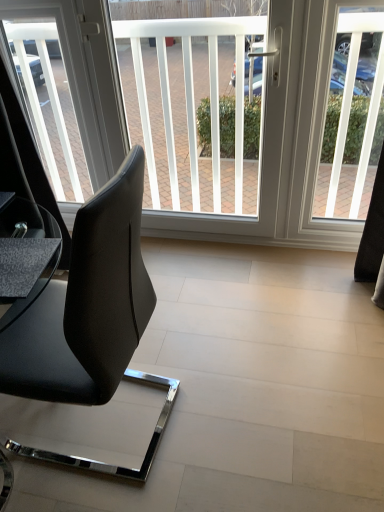
Locate an element on the screen. The width and height of the screenshot is (384, 512). vacant area that lies to the right of black leather chair at left is located at coordinates (224, 406).